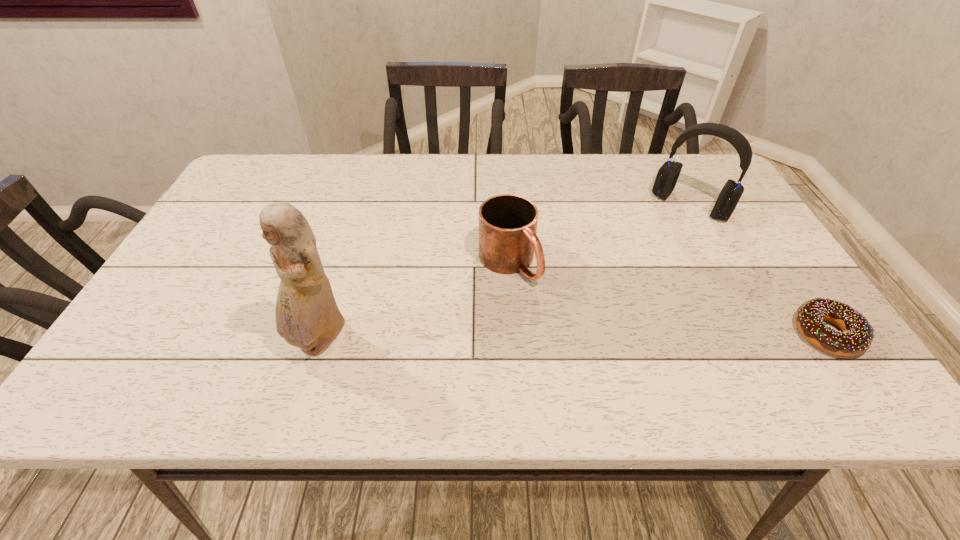
In order to click on figurine in this screenshot , I will do `click(307, 316)`.

Locate an element on the screen. the leftmost object is located at coordinates (307, 316).

Locate an element on the screen. doughnut is located at coordinates (857, 337).

The height and width of the screenshot is (540, 960). I want to click on the second tallest object, so click(668, 174).

At what (x,y) coordinates should I click in order to perform the action: click on the farthest object. Please return your answer as a coordinate pair (x, y). The width and height of the screenshot is (960, 540). Looking at the image, I should click on (668, 174).

This screenshot has height=540, width=960. Identify the location of mug. (508, 223).

This screenshot has width=960, height=540. What are the coordinates of `the third tallest object` in the screenshot? It's located at (508, 223).

Where is `vacant region located on the left of the shortest object`? vacant region located on the left of the shortest object is located at coordinates [709, 334].

Identify the location of vacant point located on the headband of the headset. (667, 233).

The width and height of the screenshot is (960, 540). Identify the location of free region located on the headband of the headset. (632, 281).